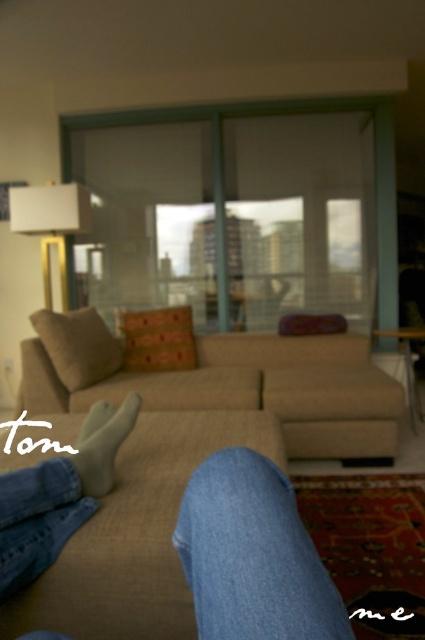
Question: Considering the relative positions of denim jeans at lower center and white glossy lamp at upper left in the image provided, where is denim jeans at lower center located with respect to white glossy lamp at upper left?

Choices:
 (A) below
 (B) above

Answer: (A)

Question: Which of the following is the closest to the observer?

Choices:
 (A) (20, 188)
 (B) (309, 609)
 (C) (108, 461)

Answer: (B)

Question: Is denim jeans at lower center above white suede sock at lower center?

Choices:
 (A) no
 (B) yes

Answer: (A)

Question: Among these objects, which one is nearest to the camera?

Choices:
 (A) beige fabric couch at center
 (B) denim jeans at lower center
 (C) white suede sock at lower center

Answer: (B)

Question: Which point appears closest to the camera in this image?

Choices:
 (A) (96, 461)
 (B) (48, 193)
 (C) (110, 476)
 (D) (295, 506)

Answer: (D)

Question: Considering the relative positions of beige fabric couch at center and white glossy lamp at upper left in the image provided, where is beige fabric couch at center located with respect to white glossy lamp at upper left?

Choices:
 (A) right
 (B) left

Answer: (A)